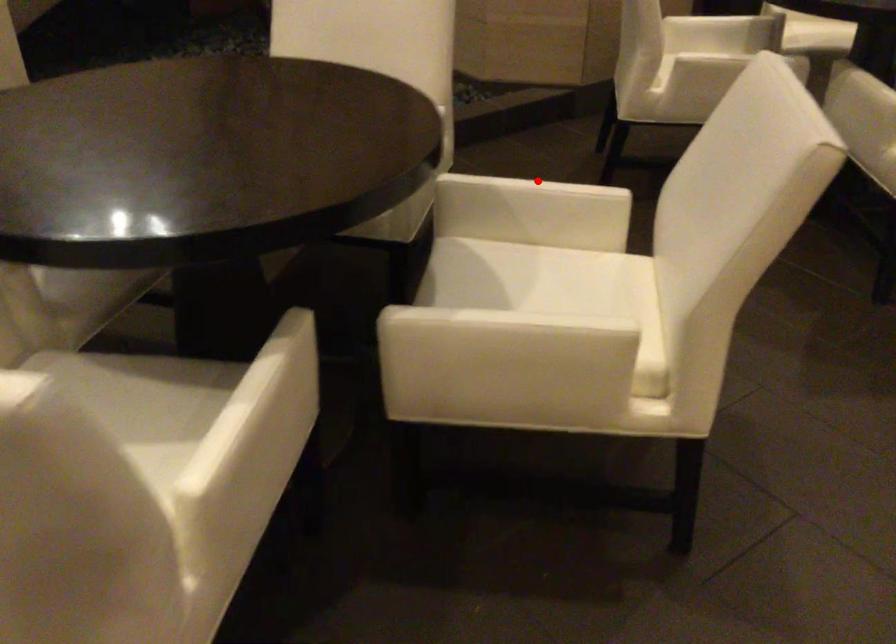
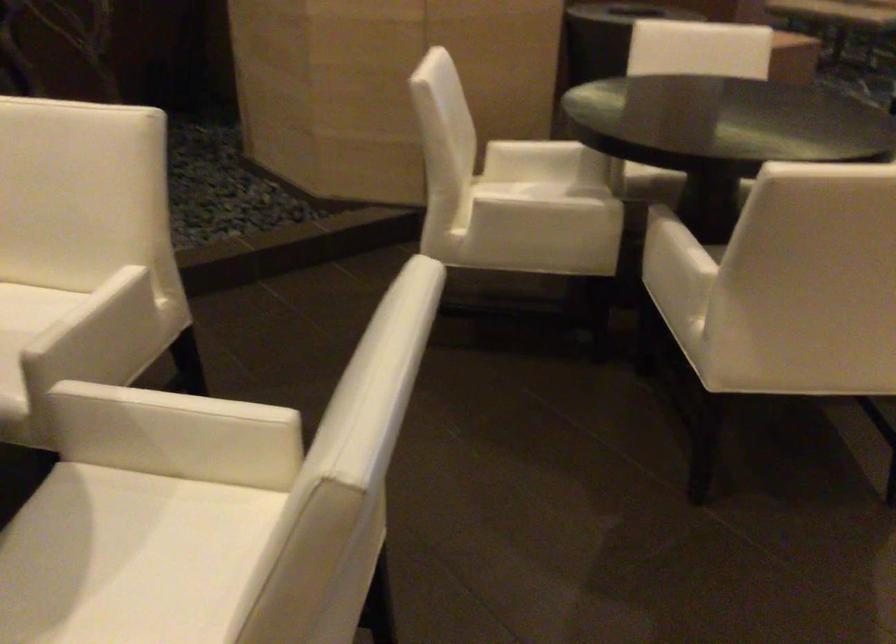
In the second image, find the point that corresponds to the highlighted location in the first image.

(179, 402)